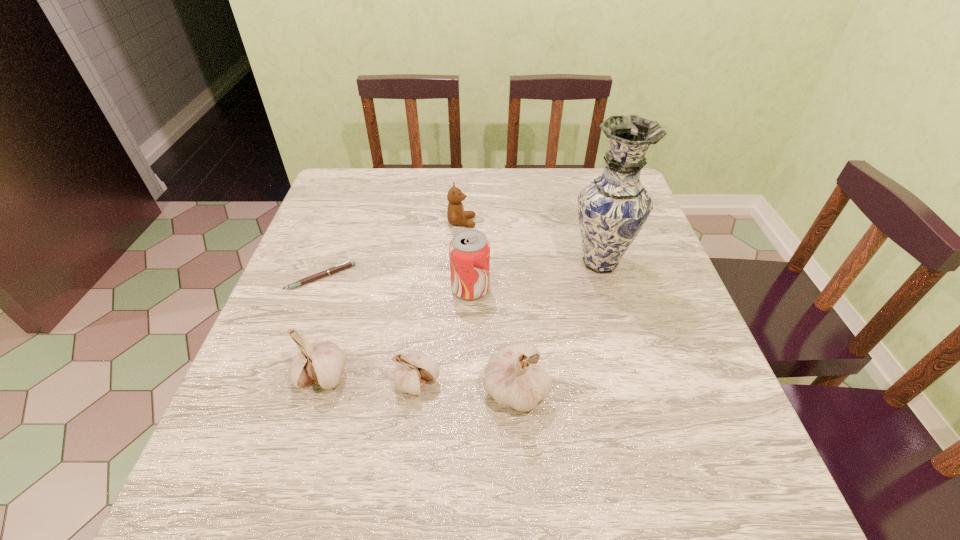
Locate an element on the screen. blank area in the image that satisfies the following two spatial constraints: 1. on the front-facing side of the farthest object; 2. on the right side of the rightmost garlic is located at coordinates (453, 389).

You are a GUI agent. You are given a task and a screenshot of the screen. Output one action in this format:
    pyautogui.click(x=<x>, y=<y>)
    Task: Click on the free spot that satisfies the following two spatial constraints: 1. on the front-facing side of the rightmost object; 2. on the right side of the farthest object
    
    Given the screenshot: What is the action you would take?
    pyautogui.click(x=460, y=262)